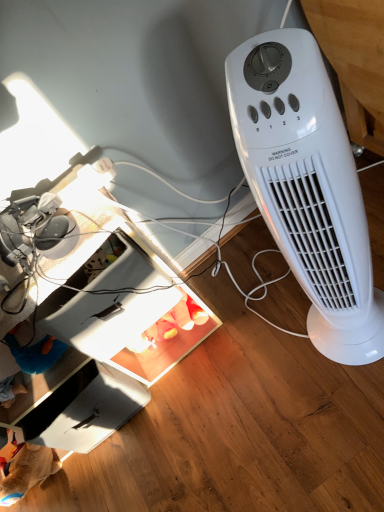
Question: In terms of width, does white plastic heater at right look wider or thinner when compared to white cardboard drawer at lower left?

Choices:
 (A) thin
 (B) wide

Answer: (A)

Question: Do you think white plastic heater at right is within white cardboard drawer at lower left, or outside of it?

Choices:
 (A) inside
 (B) outside

Answer: (B)

Question: Estimate the real-world distances between objects in this image. Which object is farther from the white plastic heater at right?

Choices:
 (A) white plastic computer desk at lower left
 (B) white cardboard drawer at lower left

Answer: (B)

Question: Which of these objects is positioned closest to the white cardboard drawer at lower left?

Choices:
 (A) white plastic heater at right
 (B) white plastic computer desk at lower left

Answer: (B)